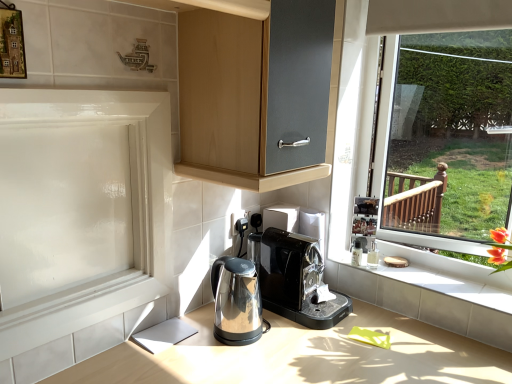
Identify the location of free space in front of stainless steel kettle at lower center, the second home appliance from the right. This screenshot has width=512, height=384. (252, 363).